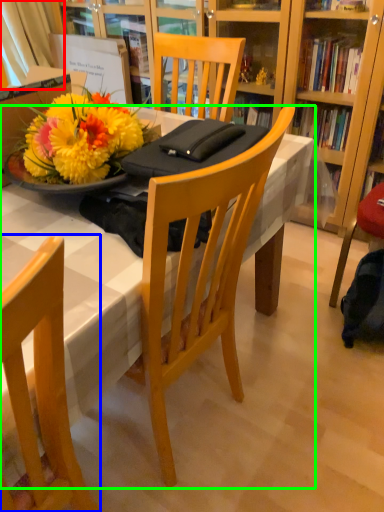
Question: Which object is the farthest from curtain (highlighted by a red box)? Choose among these: chair (highlighted by a blue box) or desk (highlighted by a green box).

Choices:
 (A) chair
 (B) desk

Answer: (A)